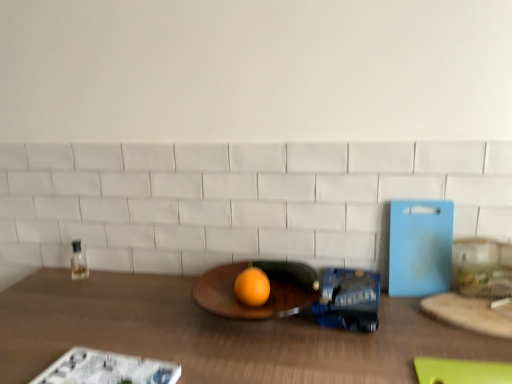
Question: In terms of width, does wooden cutting board at right look wider or thinner when compared to wooden table at center?

Choices:
 (A) thin
 (B) wide

Answer: (A)

Question: In terms of height, does wooden cutting board at right look taller or shorter compared to wooden table at center?

Choices:
 (A) short
 (B) tall

Answer: (A)

Question: Which is farther from the wooden cutting board at right?

Choices:
 (A) orange matte grapefruit at center
 (B) clear glass bottle at left
 (C) wooden table at center

Answer: (B)

Question: Considering the real-world distances, which object is farthest from the orange matte grapefruit at center?

Choices:
 (A) wooden cutting board at right
 (B) clear glass bottle at left
 (C) wooden table at center

Answer: (B)